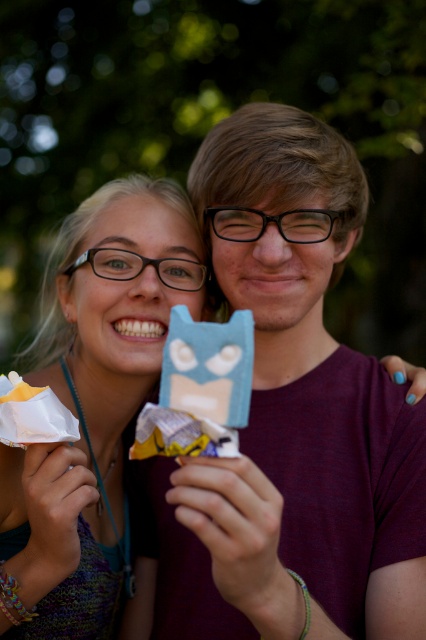
You are a photographer trying to capture the blue matte ice cream bar at center and the white paper wrapper at lower left. Which object is directly above the other?

The blue matte ice cream bar at center is positioned over the white paper wrapper at lower left, meaning it is directly above it.

You are a photographer trying to focus on two points in the image. The first point is at coordinates point (189, 340) and the second is at point (6, 394). Which point is closer to your camera lens?

Point (189, 340) is closer to the camera lens than point (6, 394).

You are a photographer trying to capture the matte blue ice cream at center and the white paper wrapper at lower left. Which object should you focus on first to ensure it appears sharp in the photo?

The matte blue ice cream at center should be focused on first because it is in front of the white paper wrapper at lower left.